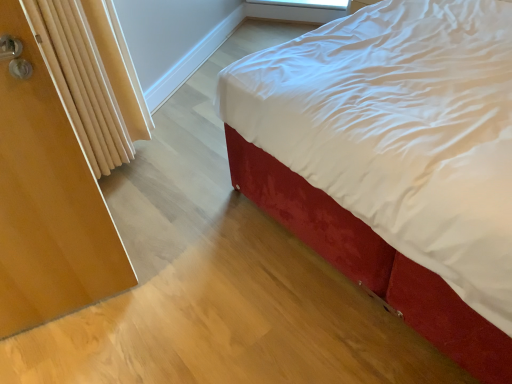
Question: Can we say transparent plastic window screen at upper center lies outside wooden radiator at left?

Choices:
 (A) yes
 (B) no

Answer: (A)

Question: Is transparent plastic window screen at upper center closer to camera compared to wooden radiator at left?

Choices:
 (A) yes
 (B) no

Answer: (B)

Question: Would you say transparent plastic window screen at upper center is a long distance from wooden radiator at left?

Choices:
 (A) no
 (B) yes

Answer: (B)

Question: From the image's perspective, is transparent plastic window screen at upper center below wooden radiator at left?

Choices:
 (A) yes
 (B) no

Answer: (B)

Question: Is transparent plastic window screen at upper center facing away from wooden radiator at left?

Choices:
 (A) no
 (B) yes

Answer: (A)

Question: Considering the relative sizes of transparent plastic window screen at upper center and wooden radiator at left in the image provided, is transparent plastic window screen at upper center bigger than wooden radiator at left?

Choices:
 (A) yes
 (B) no

Answer: (B)

Question: Is wooden radiator at left far away from transparent plastic window screen at upper center?

Choices:
 (A) yes
 (B) no

Answer: (A)

Question: Can you confirm if wooden radiator at left is bigger than transparent plastic window screen at upper center?

Choices:
 (A) no
 (B) yes

Answer: (B)

Question: From the image's perspective, is wooden radiator at left beneath transparent plastic window screen at upper center?

Choices:
 (A) no
 (B) yes

Answer: (B)

Question: Does wooden radiator at left have a lesser width compared to transparent plastic window screen at upper center?

Choices:
 (A) yes
 (B) no

Answer: (B)

Question: Does wooden radiator at left have a greater height compared to transparent plastic window screen at upper center?

Choices:
 (A) no
 (B) yes

Answer: (B)

Question: Is wooden radiator at left shorter than transparent plastic window screen at upper center?

Choices:
 (A) yes
 (B) no

Answer: (B)

Question: Is wooden screen door at left oriented away from velvet red bed at center?

Choices:
 (A) yes
 (B) no

Answer: (B)